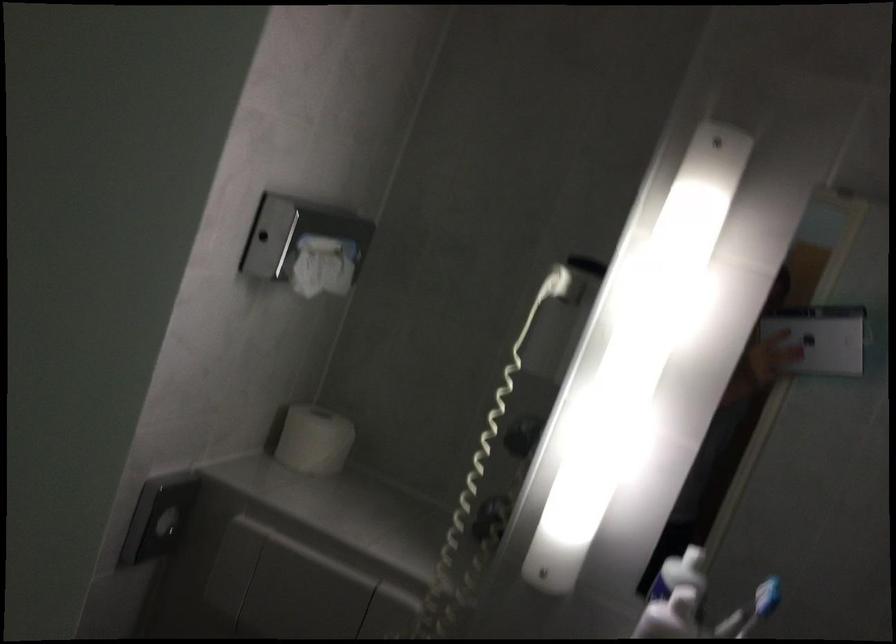
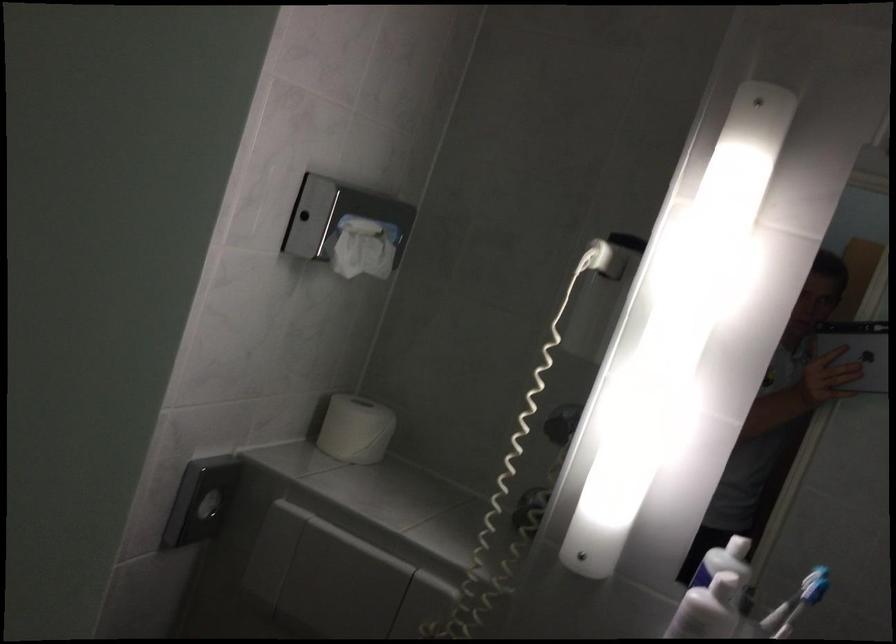
Locate, in the second image, the point that corresponds to point 165,524 in the first image.

(208, 506)